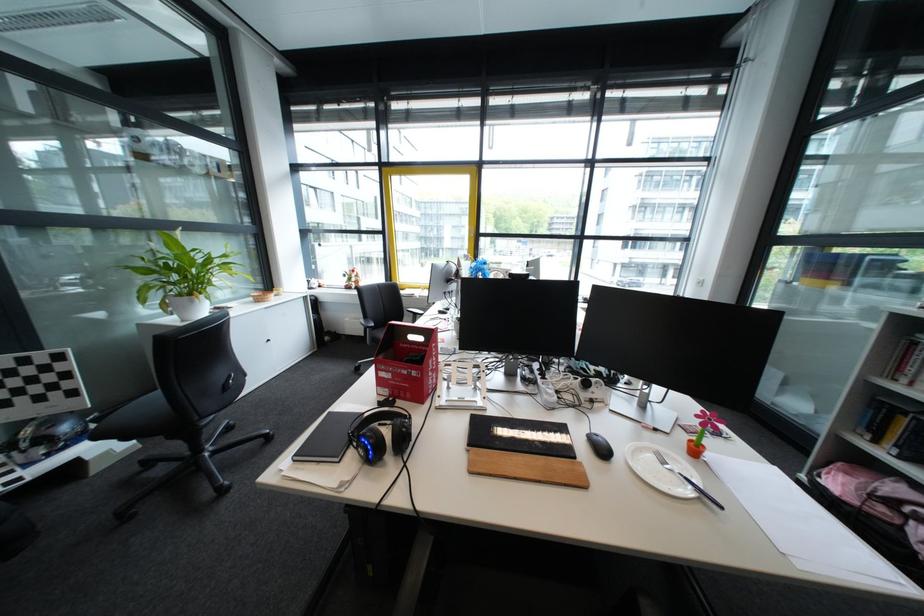
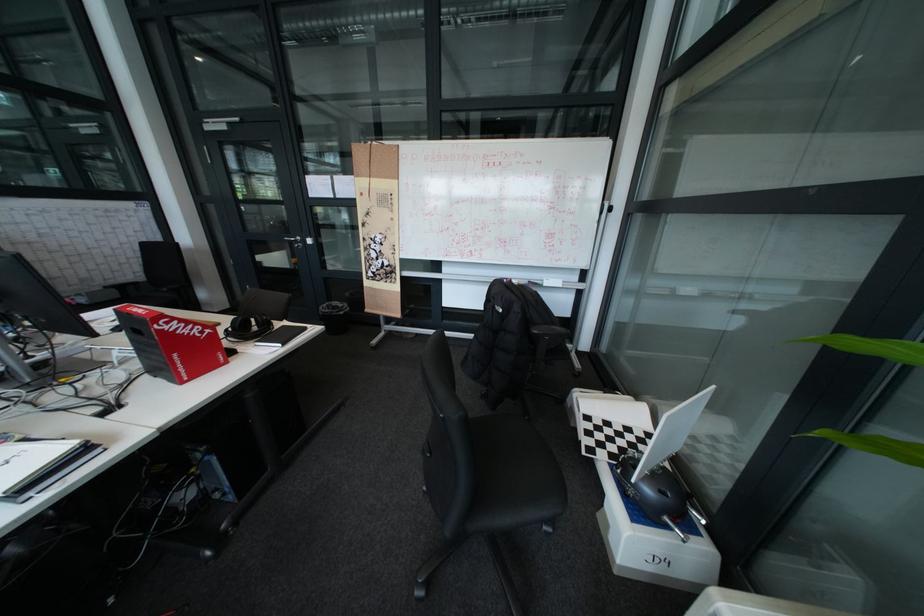
Question: I am providing you with two images of the same scene from different viewpoints. After the viewpoint changes to image2, which objects are now occluded?

Choices:
 (A) red electrical outlet
 (B) black notebook
 (C) red cardboard box
 (D) white plate

Answer: (D)